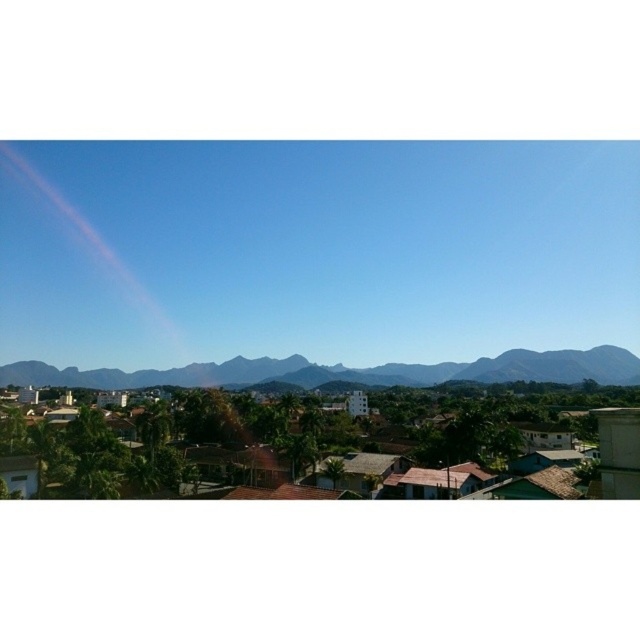
Which is in front, point (51, 266) or point (173, 369)?

Point (173, 369) is more forward.

Is point (102, 332) farther from camera compared to point (396, 369)?

Yes, it is.

The height and width of the screenshot is (640, 640). I want to click on transparent iridescent rainbow at upper left, so click(x=115, y=269).

From the picture: How distant is transparent iridescent rainbow at upper left from gray rocky mountain at center?

transparent iridescent rainbow at upper left is 213.29 feet away from gray rocky mountain at center.

Is transparent iridescent rainbow at upper left below gray rocky mountain at center?

Incorrect, transparent iridescent rainbow at upper left is not positioned below gray rocky mountain at center.

Locate an element on the screen. transparent iridescent rainbow at upper left is located at coordinates (115, 269).

Consider the image. Can you confirm if gray rocky mountain at center is positioned below green leafy mountains at center?

No.

Is gray rocky mountain at center shorter than green leafy mountains at center?

Indeed, gray rocky mountain at center has a lesser height compared to green leafy mountains at center.

Is point (129, 378) positioned behind point (227, 362)?

No, it is in front of (227, 362).

This screenshot has height=640, width=640. What are the coordinates of `gray rocky mountain at center` in the screenshot? It's located at (348, 371).